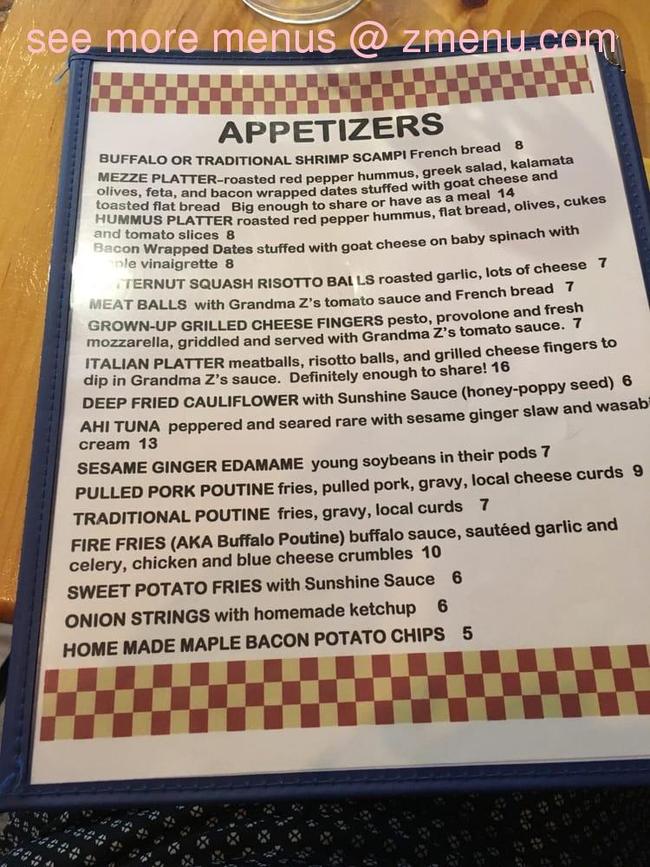
Identify the location of wood grain table top. pyautogui.click(x=30, y=238), pyautogui.click(x=578, y=10).